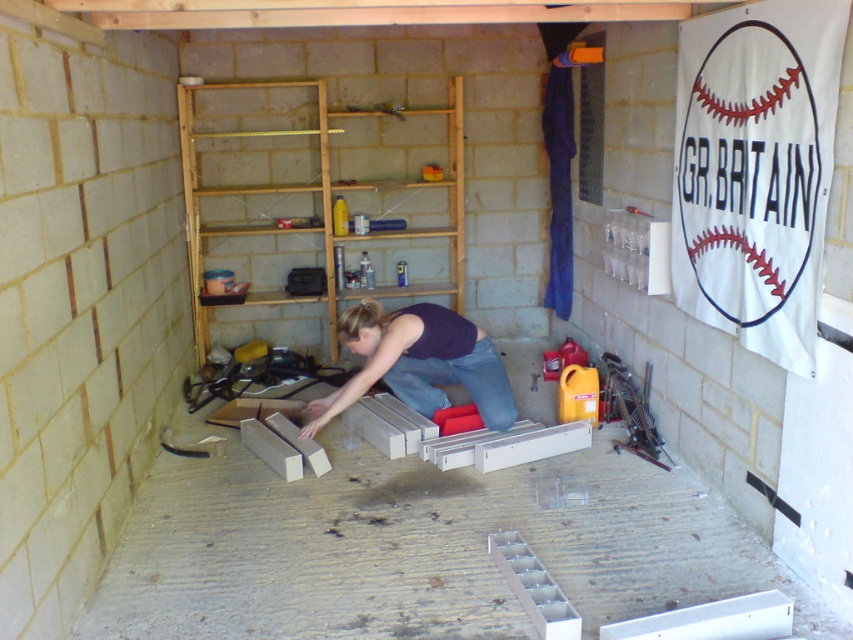
Question: Can you confirm if white matte wood at center is thinner than matte black woman at center?

Choices:
 (A) yes
 (B) no

Answer: (B)

Question: Is white matte wood at center above matte black woman at center?

Choices:
 (A) no
 (B) yes

Answer: (A)

Question: Among these points, which one is farthest from the camera?

Choices:
 (A) (451, 380)
 (B) (109, 620)

Answer: (A)

Question: Is white matte wood at center to the right of matte black woman at center from the viewer's perspective?

Choices:
 (A) no
 (B) yes

Answer: (B)